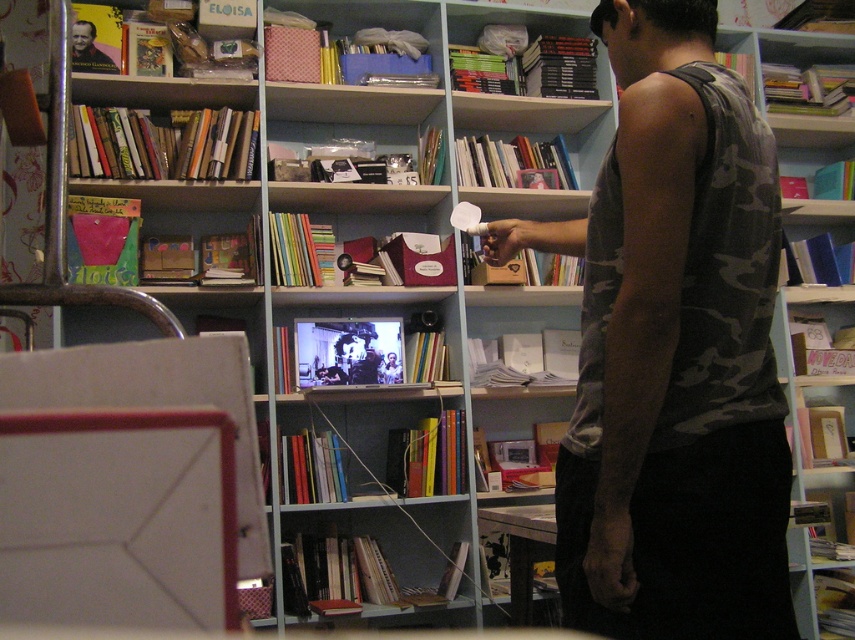
You are a customer in a bookstore and you see a camouflage tank top at center and a smooth brown book at upper left. Which item is wider?

The camouflage tank top at center is wider than the smooth brown book at upper left according to the description.

You are standing in the bookstore and want to reach both points. Which point, point [685,547] or point [101,60], is closer to you?

Point [685,547] is closer to the viewer than point [101,60].

You are a customer in the bookstore and want to find the camouflage tank top at center. According to the store layout, where should you look to find it?

The camouflage tank top at center is located at the 2D coordinates point (673, 349) in the store layout.